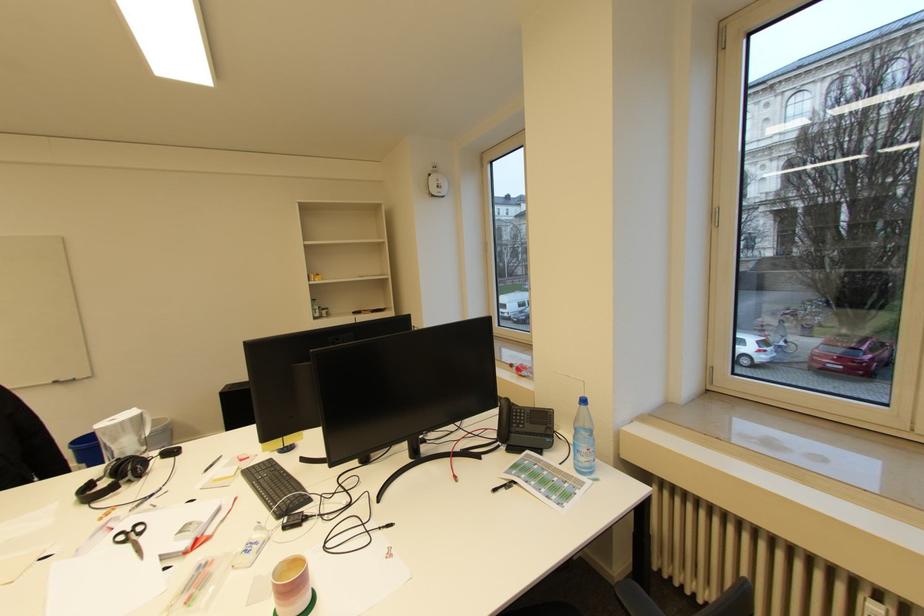
Identify the location of black chair armrest. This screenshot has width=924, height=616. (635, 599).